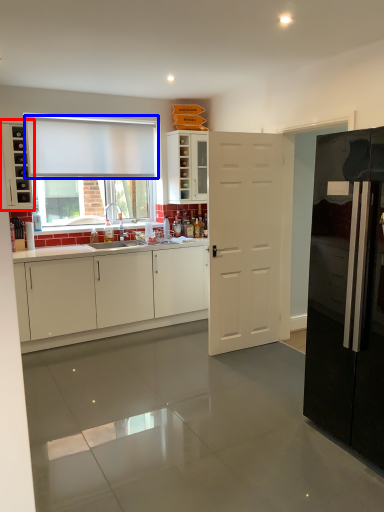
Question: Among these objects, which one is nearest to the camera, cabinetry (highlighted by a red box) or curtain (highlighted by a blue box)?

Choices:
 (A) cabinetry
 (B) curtain

Answer: (A)